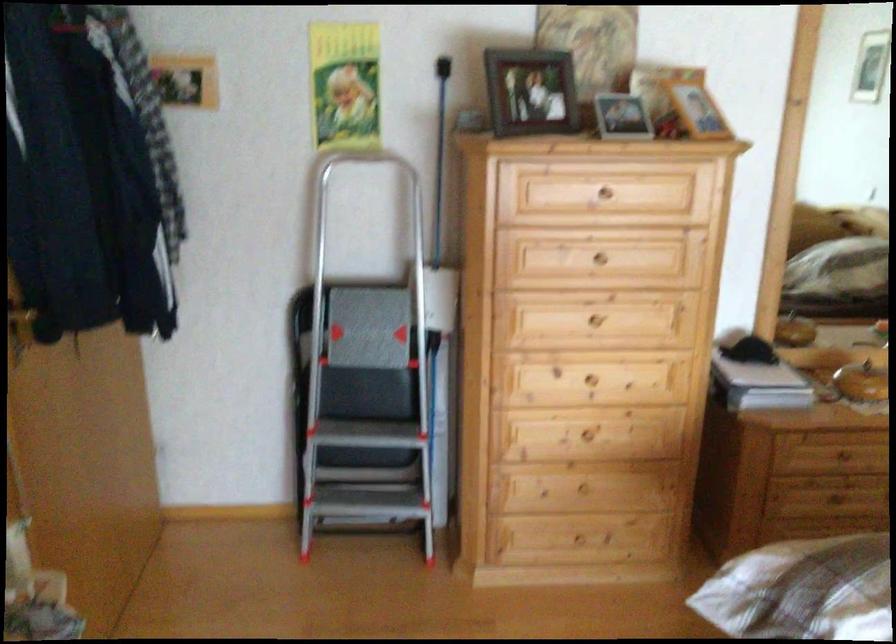
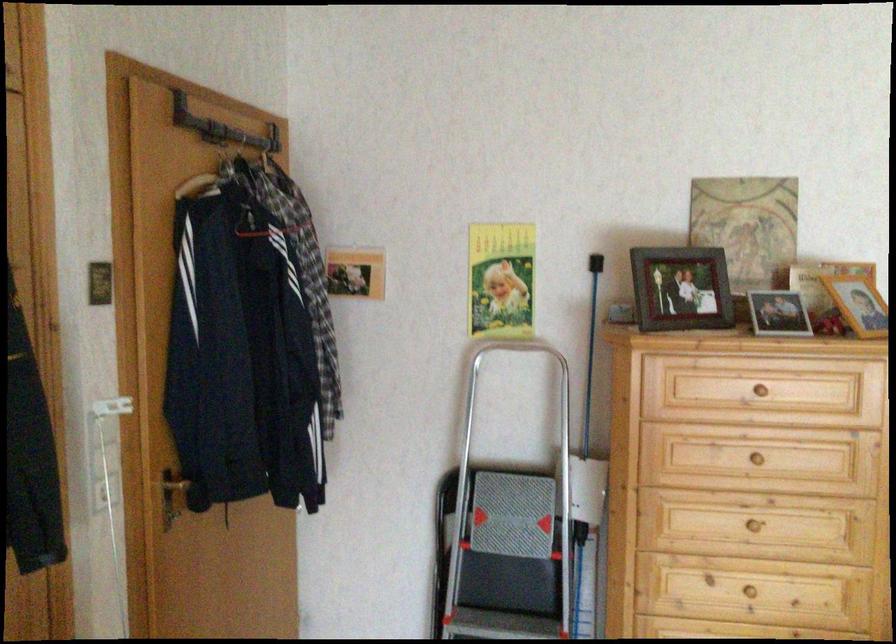
Where in the second image is the point corresponding to point (591, 321) from the first image?

(754, 526)